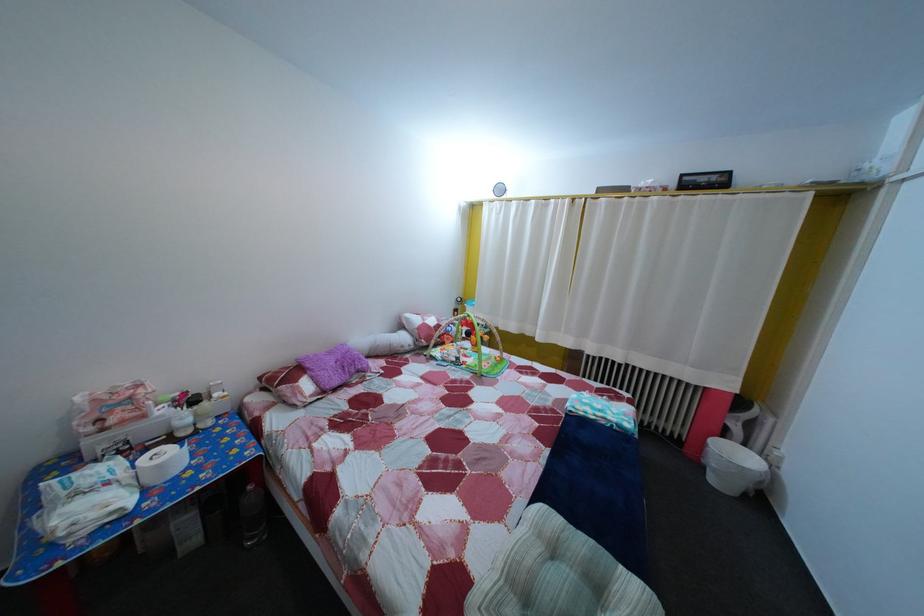
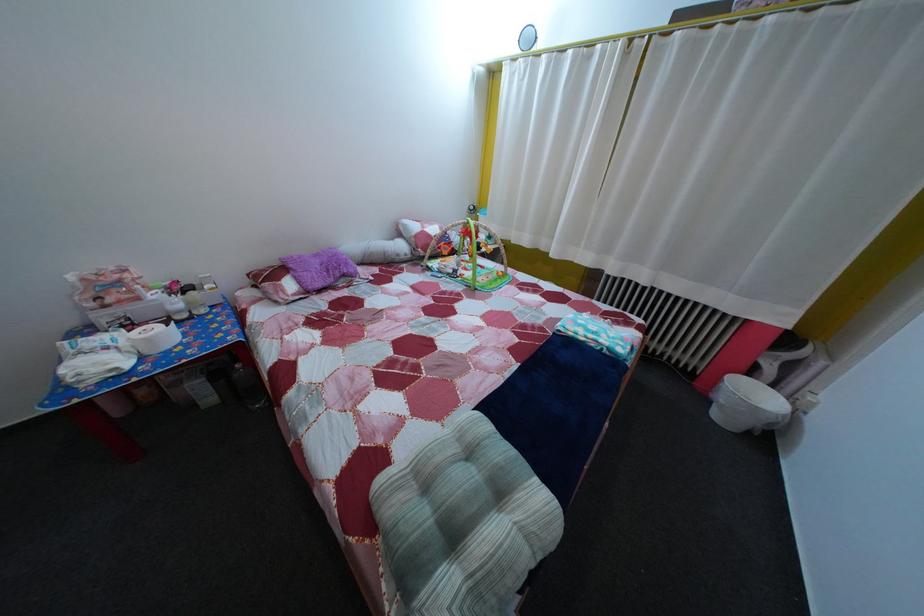
The point at (x=464, y=367) is marked in the first image. Where is the corresponding point in the second image?

(459, 278)